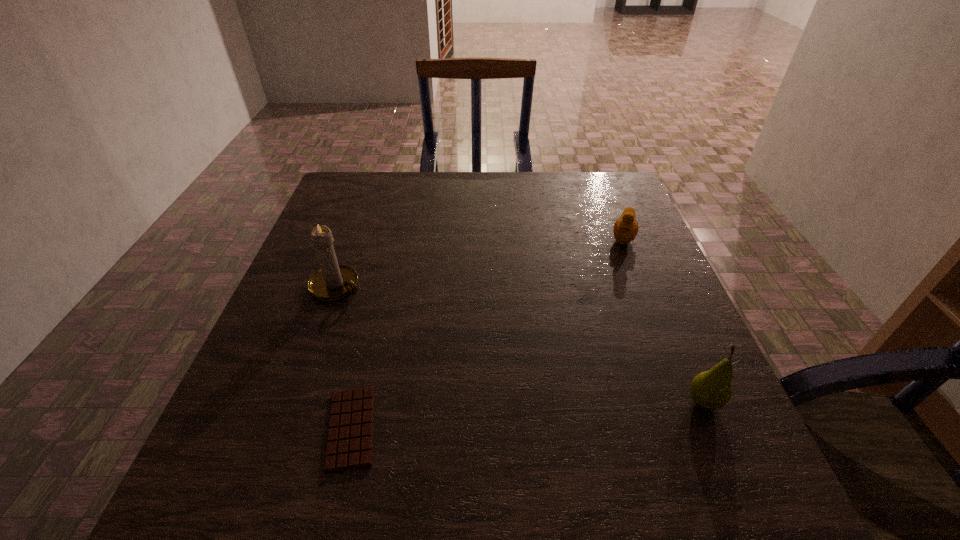
I want to click on free space on the desktop that is between the shortest object and the pear and is positioned on the face of the third tallest object, so click(x=582, y=411).

Where is `vacant space on the desktop that is between the shortest object and the third shortest object and is positioned on the handle side of the second farthest object`? The image size is (960, 540). vacant space on the desktop that is between the shortest object and the third shortest object and is positioned on the handle side of the second farthest object is located at coordinates (555, 413).